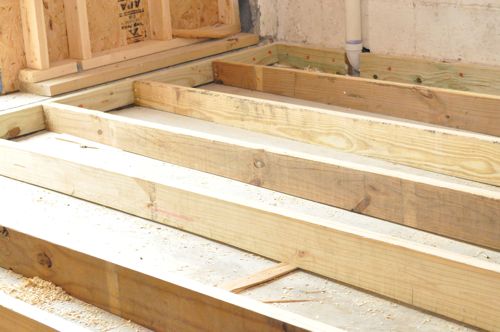
Image resolution: width=500 pixels, height=332 pixels. I want to click on grey cement floor, so click(221, 266).